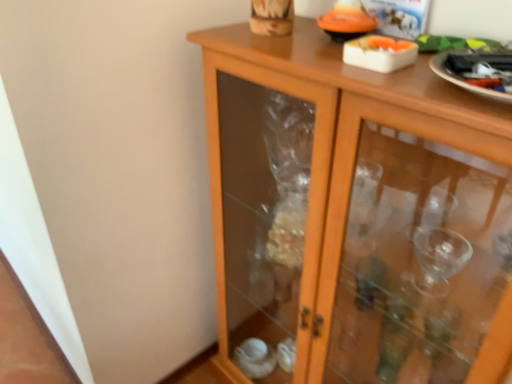
Identify the location of white glossy plate at upper right. This screenshot has width=512, height=384. (463, 78).

Describe the element at coordinates (463, 78) in the screenshot. I see `white glossy plate at upper right` at that location.

The width and height of the screenshot is (512, 384). I want to click on wooden cabinet at center, so click(355, 212).

What do you see at coordinates (355, 212) in the screenshot?
I see `wooden cabinet at center` at bounding box center [355, 212].

Image resolution: width=512 pixels, height=384 pixels. In order to click on white glossy plate at upper right in this screenshot , I will do `click(463, 78)`.

Can you confirm if wooden cabinet at center is positioned to the left of white glossy plate at upper right?

Yes.

Which object is more forward, wooden cabinet at center or white glossy plate at upper right?

wooden cabinet at center is closer to the camera.

Is point (409, 328) positioned behind point (437, 68)?

Yes, point (409, 328) is farther from viewer.

From the image's perspective, is wooden cabinet at center located beneath white glossy plate at upper right?

Yes.

From a real-world perspective, which is physically above, wooden cabinet at center or white glossy plate at upper right?

white glossy plate at upper right.

Considering the relative sizes of wooden cabinet at center and white glossy plate at upper right in the image provided, is wooden cabinet at center thinner than white glossy plate at upper right?

No.

Consider the image. Considering the relative sizes of wooden cabinet at center and white glossy plate at upper right in the image provided, is wooden cabinet at center shorter than white glossy plate at upper right?

No, wooden cabinet at center is not shorter than white glossy plate at upper right.

Based on their sizes in the image, would you say wooden cabinet at center is bigger or smaller than white glossy plate at upper right?

Clearly, wooden cabinet at center is larger in size than white glossy plate at upper right.

Can we say wooden cabinet at center lies outside white glossy plate at upper right?

wooden cabinet at center is positioned outside white glossy plate at upper right.

Are wooden cabinet at center and white glossy plate at upper right located far from each other?

wooden cabinet at center is actually quite close to white glossy plate at upper right.

Does wooden cabinet at center turn towards white glossy plate at upper right?

No.

You are a GUI agent. You are given a task and a screenshot of the screen. Output one action in this format:
    pyautogui.click(x=<x>, y=<y>)
    Task: Click on the cupboard that appears below the white glossy plate at upper right (from the image's perspective)
    
    Given the screenshot: What is the action you would take?
    pyautogui.click(x=355, y=212)

From the picture: Is white glossy plate at upper right at the left side of wooden cabinet at center?

No.

Is white glossy plate at upper right further to the viewer compared to wooden cabinet at center?

Yes, it is.

Considering the positions of point (450, 82) and point (430, 131), is point (450, 82) closer or farther from the camera than point (430, 131)?

Point (450, 82).

From the image's perspective, is white glossy plate at upper right above or below wooden cabinet at center?

white glossy plate at upper right is situated higher than wooden cabinet at center in the image.

From a real-world perspective, who is located lower, white glossy plate at upper right or wooden cabinet at center?

wooden cabinet at center, from a real-world perspective.

Is white glossy plate at upper right thinner than wooden cabinet at center?

Correct, the width of white glossy plate at upper right is less than that of wooden cabinet at center.

Between white glossy plate at upper right and wooden cabinet at center, which one has less height?

white glossy plate at upper right.

Can you confirm if white glossy plate at upper right is smaller than wooden cabinet at center?

Correct, white glossy plate at upper right occupies less space than wooden cabinet at center.

Is wooden cabinet at center inside white glossy plate at upper right?

That's incorrect, wooden cabinet at center is not inside white glossy plate at upper right.

Would you consider white glossy plate at upper right to be distant from wooden cabinet at center?

They are positioned close to each other.

Does white glossy plate at upper right turn towards wooden cabinet at center?

No, white glossy plate at upper right is not aimed at wooden cabinet at center.

Can you tell me how much white glossy plate at upper right and wooden cabinet at center differ in facing direction?

white glossy plate at upper right and wooden cabinet at center are facing 0.000261 degrees away from each other.

How far apart are white glossy plate at upper right and wooden cabinet at center?

The distance of white glossy plate at upper right from wooden cabinet at center is 63.99 centimeters.

At what (x,y) coordinates should I click in order to perform the action: click on cupboard below the white glossy plate at upper right (from a real-world perspective). Please return your answer as a coordinate pair (x, y). The width and height of the screenshot is (512, 384). Looking at the image, I should click on [x=355, y=212].

What are the coordinates of `cupboard lying below the white glossy plate at upper right (from the image's perspective)` in the screenshot? It's located at point(355,212).

The image size is (512, 384). I want to click on glass plate lying on the right of wooden cabinet at center, so click(463, 78).